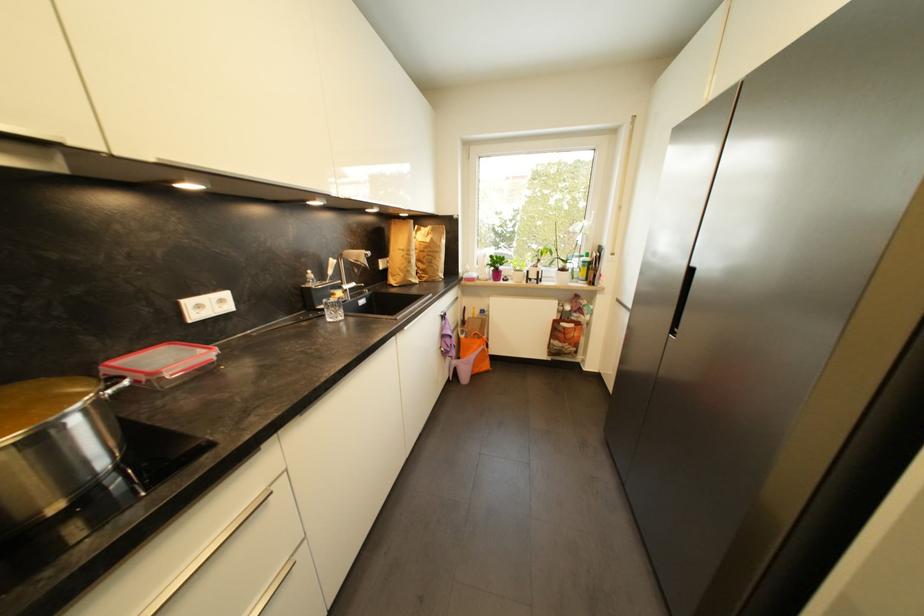
I want to click on white cabinet edge, so click(x=361, y=462).